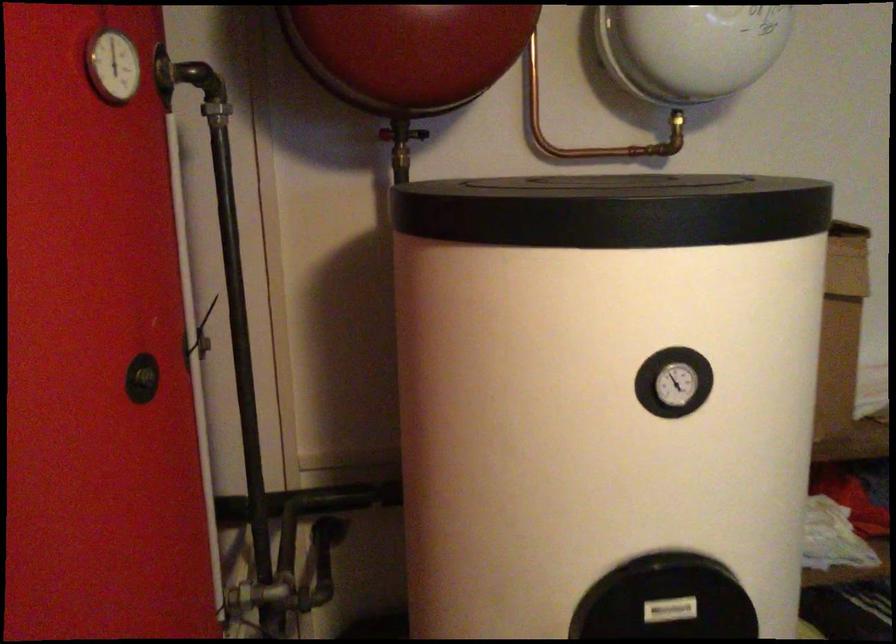
Find where to turn the brass valve handle. Please return your answer as a coordinate pair (x, y).

(421, 134)